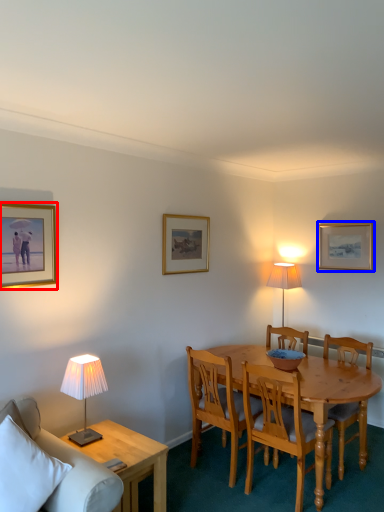
Question: Which point is closer to the camera, picture frame (highlighted by a red box) or picture frame (highlighted by a blue box)?

Choices:
 (A) picture frame
 (B) picture frame

Answer: (A)